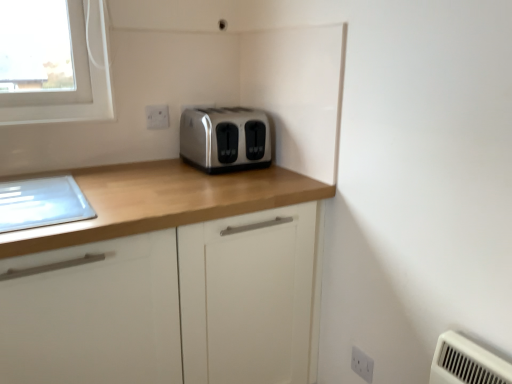
Question: In terms of height, does white plastic electric outlet at upper center, the 1th electric outlet when ordered from back to front, look taller or shorter compared to white plastic electric outlet at lower right, the 2th electric outlet in the back-to-front sequence?

Choices:
 (A) tall
 (B) short

Answer: (B)

Question: Visually, is white plastic electric outlet at upper center, acting as the first electric outlet starting from the top, positioned to the left or to the right of white plastic electric outlet at lower right, the 2th electric outlet in the back-to-front sequence?

Choices:
 (A) left
 (B) right

Answer: (A)

Question: Based on their relative distances, which object is nearer to the white plastic electric outlet at upper center, which is the 2th electric outlet in bottom-to-top order?

Choices:
 (A) matte wood cabinet at center
 (B) white plastic electric outlet at lower right, acting as the 1th electric outlet starting from the right
 (C) satin silver toaster at center

Answer: (C)

Question: Which of these objects is positioned closest to the matte wood cabinet at center?

Choices:
 (A) satin silver toaster at center
 (B) white plastic electric outlet at upper center, which is counted as the 2th electric outlet, starting from the right
 (C) white plastic electric outlet at lower right, arranged as the 1th electric outlet when viewed from the front

Answer: (A)